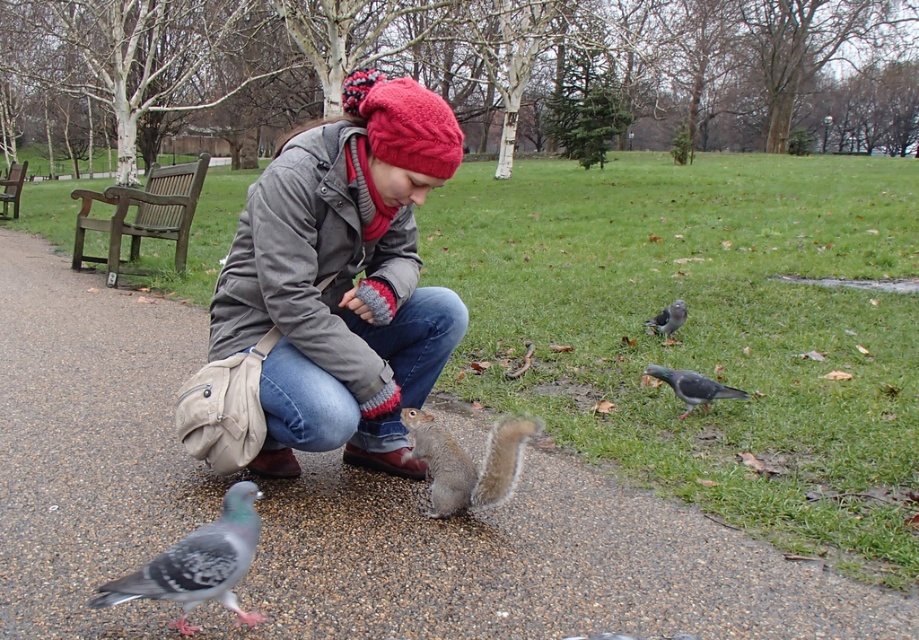
Consider the image. Is gray speckled pigeon at lower right shorter than brown wooden bench at left?

Indeed, gray speckled pigeon at lower right has a lesser height compared to brown wooden bench at left.

From the picture: Between gray speckled pigeon at lower right and brown wooden bench at left, which one has less height?

With less height is gray speckled pigeon at lower right.

Where is `gray speckled pigeon at lower right`? The width and height of the screenshot is (919, 640). gray speckled pigeon at lower right is located at coordinates click(693, 387).

Can you confirm if gray furry squirrel at center is taller than gray speckled pigeon at right?

Indeed, gray furry squirrel at center has a greater height compared to gray speckled pigeon at right.

Can you confirm if gray furry squirrel at center is shorter than gray speckled pigeon at right?

In fact, gray furry squirrel at center may be taller than gray speckled pigeon at right.

Who is more forward, (403, 420) or (675, 305)?

Point (403, 420) is more forward.

Find the location of a particular element. gray furry squirrel at center is located at coordinates (467, 461).

Does gray speckled pigeon at lower right appear over gray speckled pigeon at right?

No.

In the scene shown: Between gray speckled pigeon at lower right and gray speckled pigeon at right, which one appears on the left side from the viewer's perspective?

From the viewer's perspective, gray speckled pigeon at lower right appears more on the left side.

Is point (675, 385) closer to camera compared to point (660, 316)?

Yes, it is.

Locate an element on the screen. The width and height of the screenshot is (919, 640). gray speckled pigeon at lower right is located at coordinates (693, 387).